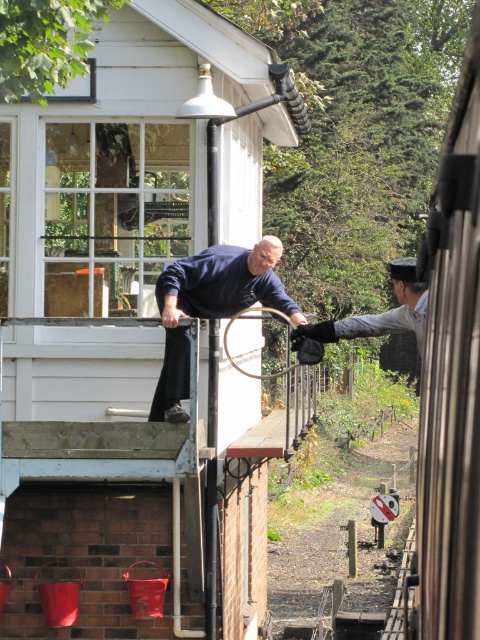
You are standing in front of the railway signal box. There is a metallic silver train at right. Where is the point with coordinates point (452, 378) located?

The point (452, 378) is located on the metallic silver train at right.